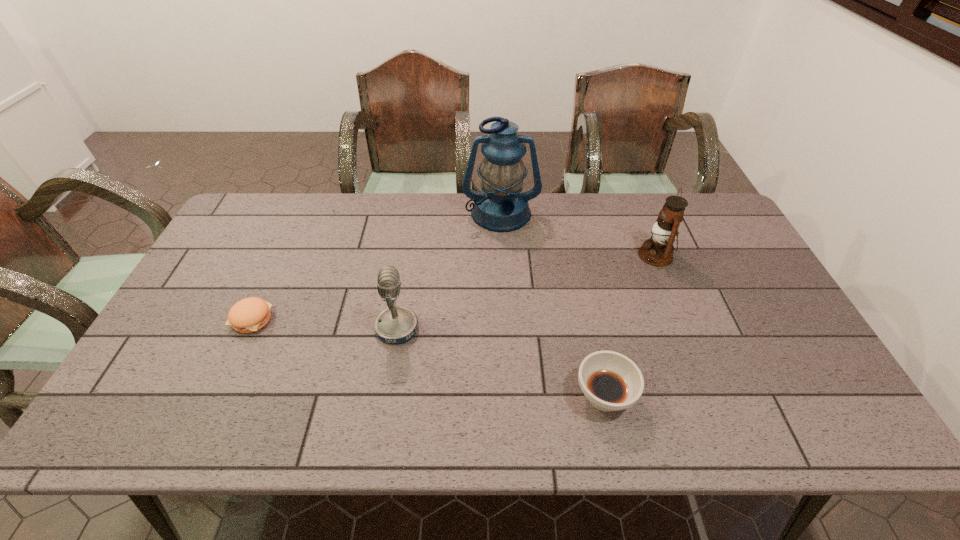
Locate an element on the screen. This screenshot has width=960, height=540. empty space that is in between the microphone and the shortest object is located at coordinates coord(324,323).

Identify the location of free point between the soup bowl and the patty. (428, 357).

Locate an element on the screen. The image size is (960, 540). vacant area between the third object from left to right and the leftmost object is located at coordinates (376, 266).

Select which object is the third closest to the right lantern. Please provide its 2D coordinates. Your answer should be formatted as a tuple, i.e. [(x, y)], where the tuple contains the x and y coordinates of a point satisfying the conditions above.

[(397, 324)]

This screenshot has width=960, height=540. Identify the location of object that ranks as the third closest to the farthest object. (610, 381).

You are a GUI agent. You are given a task and a screenshot of the screen. Output one action in this format:
    pyautogui.click(x=<x>, y=<y>)
    Task: Click on the free space that satisfies the following two spatial constraints: 1. on the face of the soup bowl; 2. on the right side of the tallest object
    The image size is (960, 540).
    Given the screenshot: What is the action you would take?
    pyautogui.click(x=511, y=396)

You are a GUI agent. You are given a task and a screenshot of the screen. Output one action in this format:
    pyautogui.click(x=<x>, y=<y>)
    Task: Click on the blank area in the image that satisfies the following two spatial constraints: 1. on the front-facing side of the microphone; 2. on the left side of the fourth object from left to right
    The width and height of the screenshot is (960, 540).
    Given the screenshot: What is the action you would take?
    pyautogui.click(x=386, y=396)

You are a GUI agent. You are given a task and a screenshot of the screen. Output one action in this format:
    pyautogui.click(x=<x>, y=<y>)
    Task: Click on the free location that satisfies the following two spatial constraints: 1. on the face of the left lantern; 2. on the left side of the second object from right to left
    This screenshot has width=960, height=540.
    Given the screenshot: What is the action you would take?
    pyautogui.click(x=511, y=396)

Where is `vacant space that satisfies the following two spatial constraints: 1. on the front-facing side of the nearest object; 2. on the left side of the fourth object from right to left`? This screenshot has height=540, width=960. vacant space that satisfies the following two spatial constraints: 1. on the front-facing side of the nearest object; 2. on the left side of the fourth object from right to left is located at coordinates (386, 396).

Locate an element on the screen. The height and width of the screenshot is (540, 960). free space that satisfies the following two spatial constraints: 1. on the front-facing side of the second object from left to right; 2. on the right side of the fourth tallest object is located at coordinates (386, 396).